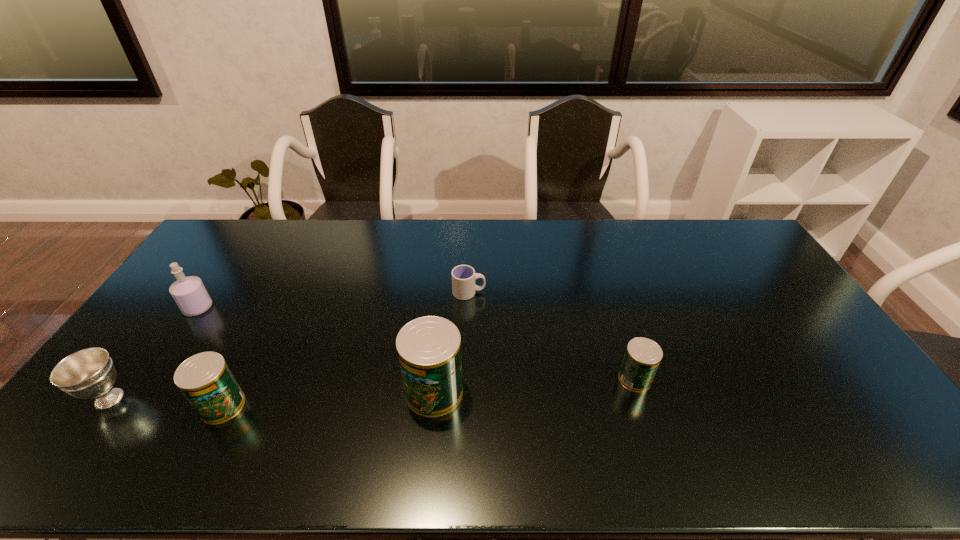
Please point a free position for a can on the right. Please provide its 2D coordinates. Your answer should be formatted as a tuple, i.e. [(x, y)], where the tuple contains the x and y coordinates of a point satisfying the conditions above.

[(826, 366)]